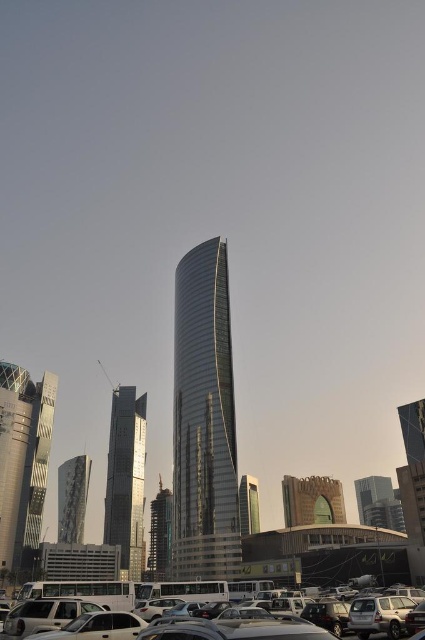
Is point (42, 401) positioned in front of point (74, 529)?

That is True.

Is metallic glass skyscraper at left above reflective glass tower at center?

Indeed, metallic glass skyscraper at left is positioned over reflective glass tower at center.

What are the coordinates of `metallic glass skyscraper at left` in the screenshot? It's located at (22, 460).

Can you confirm if metallic glass tower at center is positioned below glassy silver tower at center?

Yes.

Is point (149, 548) closer to viewer compared to point (246, 524)?

That is False.

Which is behind, point (159, 564) or point (246, 493)?

The point (246, 493) is more distant.

Find the location of a particular element. Image resolution: width=425 pixels, height=640 pixels. metallic glass tower at center is located at coordinates (159, 532).

Does reflective glass tower at center appear on the left side of metallic glass tower at center?

Indeed, reflective glass tower at center is positioned on the left side of metallic glass tower at center.

Who is more forward, [82,456] or [166,538]?

Point [82,456]

Who is more forward, (90,461) or (150,564)?

Point (150,564) is more forward.

Where is `reflective glass tower at center`? Image resolution: width=425 pixels, height=640 pixels. reflective glass tower at center is located at coordinates (73, 499).